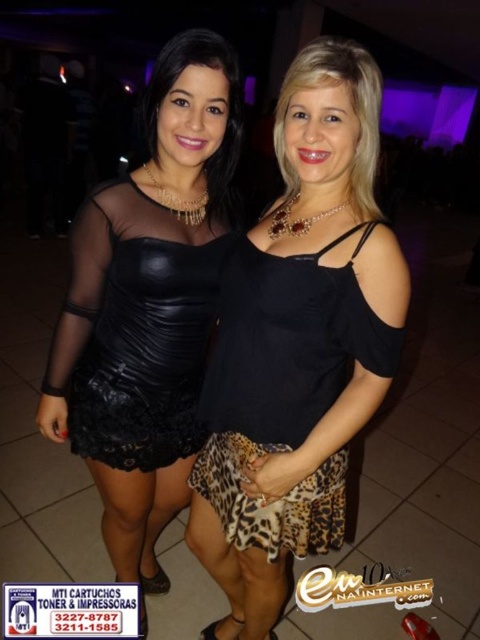
Does matte black dress at center have a greater width compared to black leather dress at left?

Yes, matte black dress at center is wider than black leather dress at left.

Between point (168, 516) and point (111, 292), which one is positioned behind?

The point (168, 516) is behind.

At what (x,y) coordinates should I click in order to perform the action: click on matte black dress at center. Please return your answer as a coordinate pair (x, y). The width and height of the screenshot is (480, 640). Looking at the image, I should click on coord(147,305).

What do you see at coordinates (147, 305) in the screenshot? This screenshot has height=640, width=480. I see `matte black dress at center` at bounding box center [147, 305].

Which is in front, point (175, 490) or point (379, 346)?

Positioned in front is point (379, 346).

This screenshot has height=640, width=480. Find the location of `matte black dress at center`. matte black dress at center is located at coordinates (147, 305).

Is leopard print skirt at center wider than black leather dress at left?

Yes, leopard print skirt at center is wider than black leather dress at left.

Between point (263, 440) and point (175, 349), which one is positioned in front?

Point (263, 440)

Identify the location of leopard print skirt at center. (285, 390).